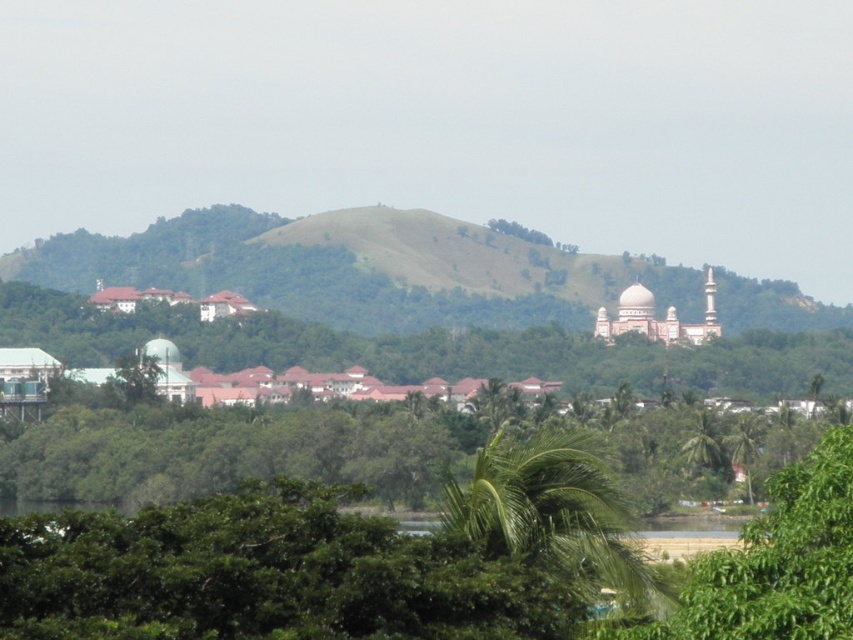
You are planning to build a small garden shed on the green grassy hillside at center. Considering the height of the green leafy tree at center, will the shed be visible from the top of the tree?

The green grassy hillside at center is taller than the green leafy tree at center. Therefore, the shed built on the hillside will be higher than the tree, making it visible from the top of the tree.